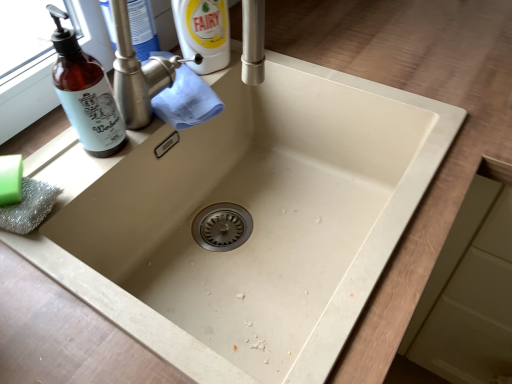
Question: From a real-world perspective, is brown glass bottle at left positioned above or below brushed metal tap at upper center?

Choices:
 (A) above
 (B) below

Answer: (A)

Question: Is point (101, 137) positioned closer to the camera than point (167, 66)?

Choices:
 (A) farther
 (B) closer

Answer: (B)

Question: Which object is the closest to the green matte soap at lower left?

Choices:
 (A) brushed metal tap at upper center
 (B) brown glass bottle at left

Answer: (B)

Question: Which object is positioned closest to the brown glass bottle at left?

Choices:
 (A) green matte soap at lower left
 (B) brushed metal tap at upper center

Answer: (B)